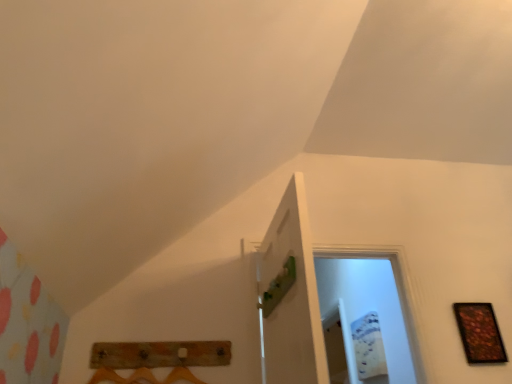
Question: In the image, is green matte door at center on the left side or the right side of wooden picture frame at right?

Choices:
 (A) right
 (B) left

Answer: (B)

Question: In terms of height, does green matte door at center look taller or shorter compared to wooden picture frame at right?

Choices:
 (A) short
 (B) tall

Answer: (B)

Question: Which is farther from the wooden picture frame at right?

Choices:
 (A) rustic wood coat rack at lower center
 (B) green matte door at center

Answer: (A)

Question: Estimate the real-world distances between objects in this image. Which object is farther from the wooden picture frame at right?

Choices:
 (A) rustic wood coat rack at lower center
 (B) green matte door at center

Answer: (A)